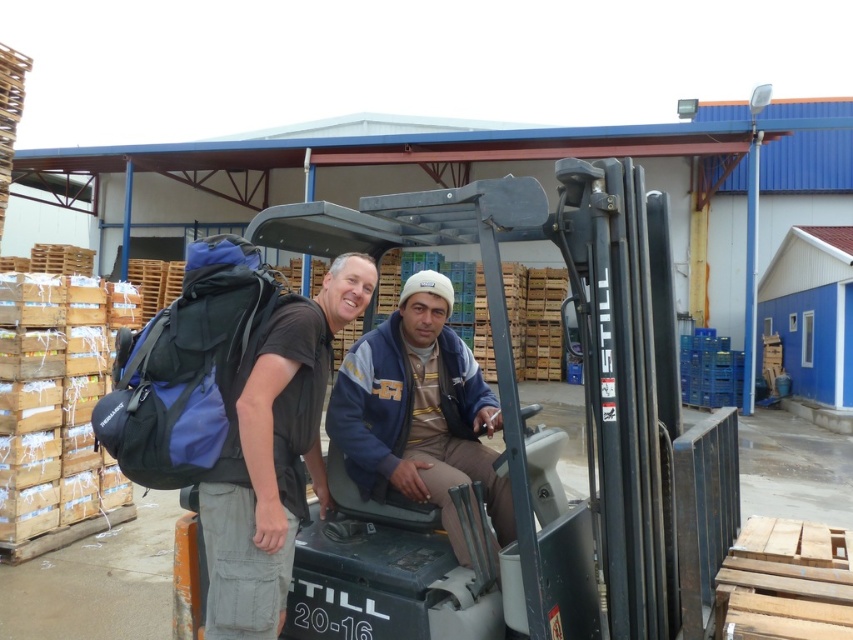
Question: Where is dark blue backpack at left located in relation to blue fleece jacket at center in the image?

Choices:
 (A) below
 (B) above

Answer: (B)

Question: Which of the following is the closest to the observer?

Choices:
 (A) dark blue backpack at left
 (B) blue fleece jacket at center

Answer: (A)

Question: Can you confirm if dark blue backpack at left is thinner than blue fleece jacket at center?

Choices:
 (A) yes
 (B) no

Answer: (A)

Question: Is dark blue backpack at left smaller than blue fleece jacket at center?

Choices:
 (A) yes
 (B) no

Answer: (B)

Question: Which object is farther from the camera taking this photo?

Choices:
 (A) dark blue backpack at left
 (B) blue fleece jacket at center

Answer: (B)